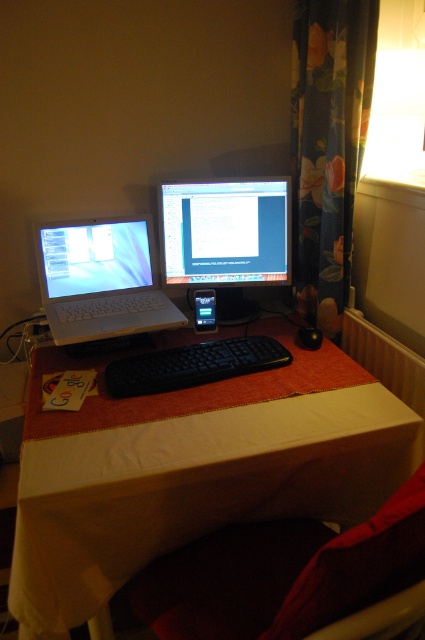
You are organizing your desk and want to place a new mouse between the white plastic laptop at left and the black matte keyboard at center. Based on their positions, where should you place the mouse?

The white plastic laptop at left is to the left of the black matte keyboard at center, so you should place the mouse to the right of the white plastic laptop at left but to the left of the black matte keyboard at center to position it between them.